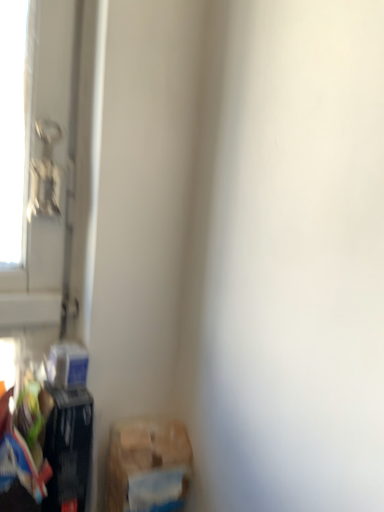
Question: Considering the relative sizes of brown cardboard box at lower left, positioned as the 2th waste in left-to-right order, and matte black trash can at lower left, marked as the first waste in a left-to-right arrangement, in the image provided, is brown cardboard box at lower left, positioned as the 2th waste in left-to-right order, taller than matte black trash can at lower left, marked as the first waste in a left-to-right arrangement,?

Choices:
 (A) yes
 (B) no

Answer: (B)

Question: Is brown cardboard box at lower left, positioned as the 2th waste in left-to-right order, located outside matte black trash can at lower left, marked as the second waste in a right-to-left arrangement?

Choices:
 (A) no
 (B) yes

Answer: (B)

Question: From a real-world perspective, does brown cardboard box at lower left, positioned as the 2th waste in left-to-right order, stand above matte black trash can at lower left, marked as the first waste in a left-to-right arrangement?

Choices:
 (A) no
 (B) yes

Answer: (A)

Question: Can you confirm if brown cardboard box at lower left, positioned as the first waste in right-to-left order, is positioned to the right of matte black trash can at lower left, marked as the first waste in a left-to-right arrangement?

Choices:
 (A) yes
 (B) no

Answer: (A)

Question: Considering the relative sizes of brown cardboard box at lower left, positioned as the 2th waste in left-to-right order, and matte black trash can at lower left, marked as the second waste in a right-to-left arrangement, in the image provided, is brown cardboard box at lower left, positioned as the 2th waste in left-to-right order, bigger than matte black trash can at lower left, marked as the second waste in a right-to-left arrangement,?

Choices:
 (A) no
 (B) yes

Answer: (B)

Question: Is brown cardboard box at lower left, positioned as the first waste in right-to-left order, thinner than matte black trash can at lower left, marked as the first waste in a left-to-right arrangement?

Choices:
 (A) no
 (B) yes

Answer: (B)

Question: Would you say matte black trash can at lower left, marked as the second waste in a right-to-left arrangement, is a long distance from brown cardboard box at lower left, positioned as the 2th waste in left-to-right order?

Choices:
 (A) no
 (B) yes

Answer: (A)

Question: Is matte black trash can at lower left, marked as the second waste in a right-to-left arrangement, not inside brown cardboard box at lower left, positioned as the 2th waste in left-to-right order?

Choices:
 (A) no
 (B) yes

Answer: (B)

Question: Does matte black trash can at lower left, marked as the second waste in a right-to-left arrangement, turn towards brown cardboard box at lower left, positioned as the 2th waste in left-to-right order?

Choices:
 (A) yes
 (B) no

Answer: (B)

Question: Is matte black trash can at lower left, marked as the first waste in a left-to-right arrangement, to the right of brown cardboard box at lower left, positioned as the first waste in right-to-left order, from the viewer's perspective?

Choices:
 (A) no
 (B) yes

Answer: (A)

Question: From a real-world perspective, is matte black trash can at lower left, marked as the second waste in a right-to-left arrangement, below brown cardboard box at lower left, positioned as the first waste in right-to-left order?

Choices:
 (A) yes
 (B) no

Answer: (B)

Question: Is matte black trash can at lower left, marked as the first waste in a left-to-right arrangement, in contact with brown cardboard box at lower left, positioned as the 2th waste in left-to-right order?

Choices:
 (A) yes
 (B) no

Answer: (B)

Question: Relative to brown cardboard box at lower left, positioned as the first waste in right-to-left order, is matte black trash can at lower left, marked as the second waste in a right-to-left arrangement, in front or behind?

Choices:
 (A) behind
 (B) front

Answer: (A)